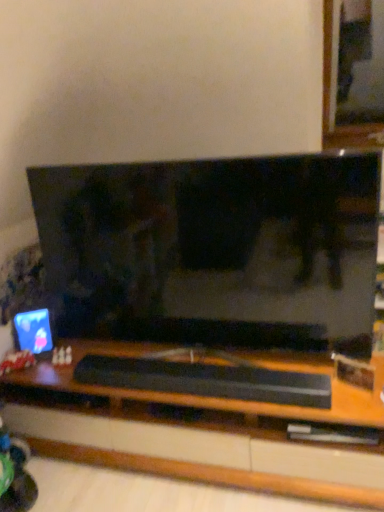
Question: Visually, is black matte soundbar at center positioned to the left or to the right of matte plastic computer monitor at left?

Choices:
 (A) right
 (B) left

Answer: (A)

Question: Considering their positions, is black matte soundbar at center located in front of or behind matte plastic computer monitor at left?

Choices:
 (A) front
 (B) behind

Answer: (A)

Question: Based on their relative distances, which object is farther from the matte plastic computer monitor at left?

Choices:
 (A) plush fabric teddy bear at lower left
 (B) black glossy television at center
 (C) black matte soundbar at center

Answer: (B)

Question: Which of these objects is positioned farthest from the plush fabric teddy bear at lower left?

Choices:
 (A) black glossy television at center
 (B) matte plastic computer monitor at left
 (C) black matte soundbar at center

Answer: (A)